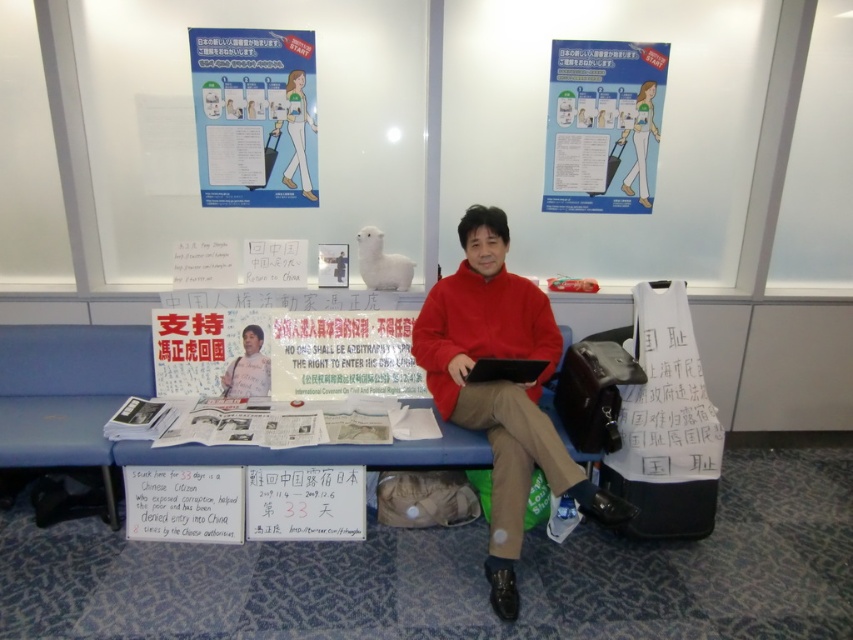
Between blue paper poster at upper left and blue paper poster at upper center, which one is positioned lower?

blue paper poster at upper center is lower down.

Between point (254, 86) and point (625, 168), which one is positioned in front?

Positioned in front is point (254, 86).

At what (x,y) coordinates should I click in order to perform the action: click on blue paper poster at upper left. Please return your answer as a coordinate pair (x, y). The image size is (853, 640). Looking at the image, I should click on (254, 116).

Is point (503, 330) closer to camera compared to point (563, 188)?

Yes, point (503, 330) is closer to viewer.

Between point (474, 413) and point (556, 65), which one is positioned behind?

The point (556, 65) is more distant.

Identify the location of red fleece sweater at center. This screenshot has width=853, height=640. (498, 387).

You are a GUI agent. You are given a task and a screenshot of the screen. Output one action in this format:
    pyautogui.click(x=<x>, y=<y>)
    Task: Click on the red fleece sweater at center
    The image size is (853, 640).
    Given the screenshot: What is the action you would take?
    pyautogui.click(x=498, y=387)

Does blue paper poster at upper center have a larger size compared to matte red sweater at center?

Yes, blue paper poster at upper center is bigger than matte red sweater at center.

Which is below, blue paper poster at upper center or matte red sweater at center?

matte red sweater at center is below.

Is point (585, 198) farther from viewer compared to point (227, 380)?

Yes, it is behind point (227, 380).

This screenshot has width=853, height=640. In order to click on blue paper poster at upper center in this screenshot , I will do `click(602, 125)`.